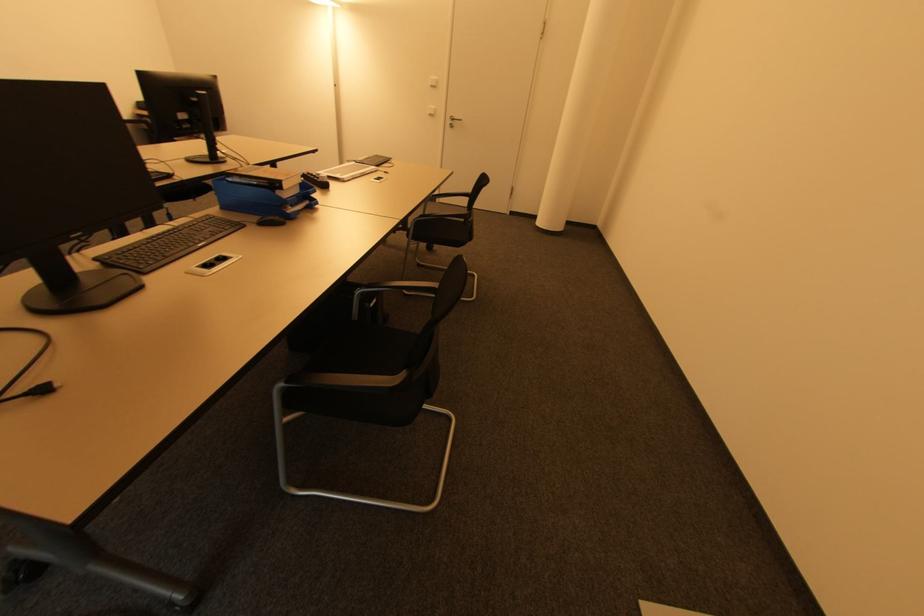
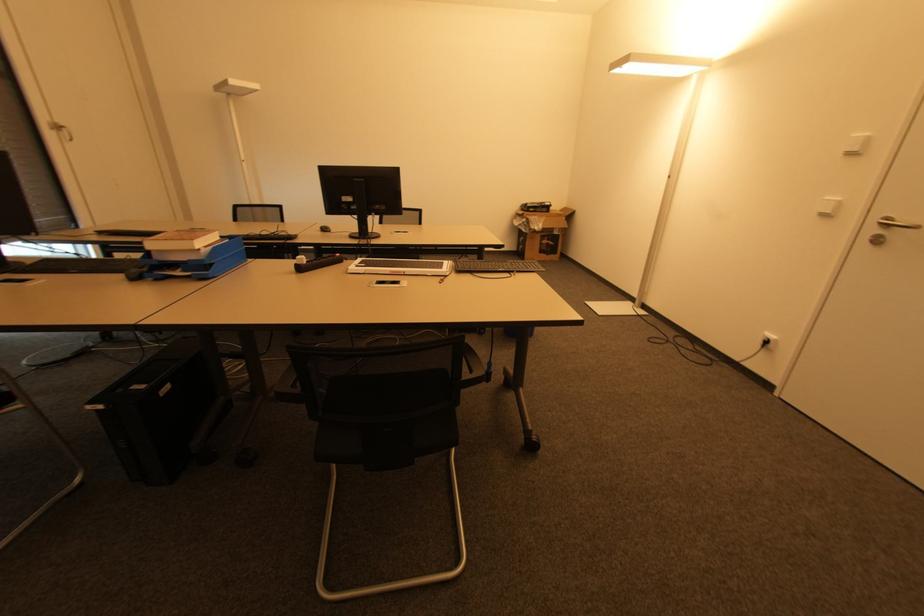
Find the pixel in the second image that matches point 375,301 in the first image.

(101, 408)